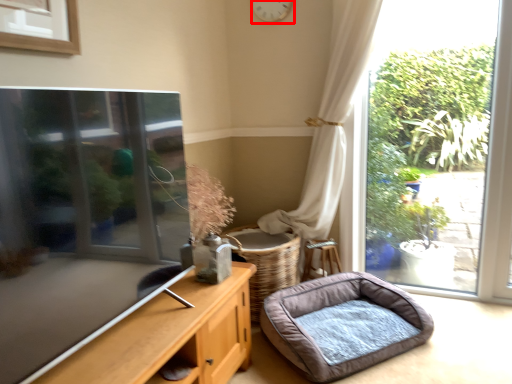
Question: From the image's perspective, considering the relative positions of clock (annotated by the red box) and dog bed in the image provided, where is clock (annotated by the red box) located with respect to the staircase?

Choices:
 (A) above
 (B) below

Answer: (A)